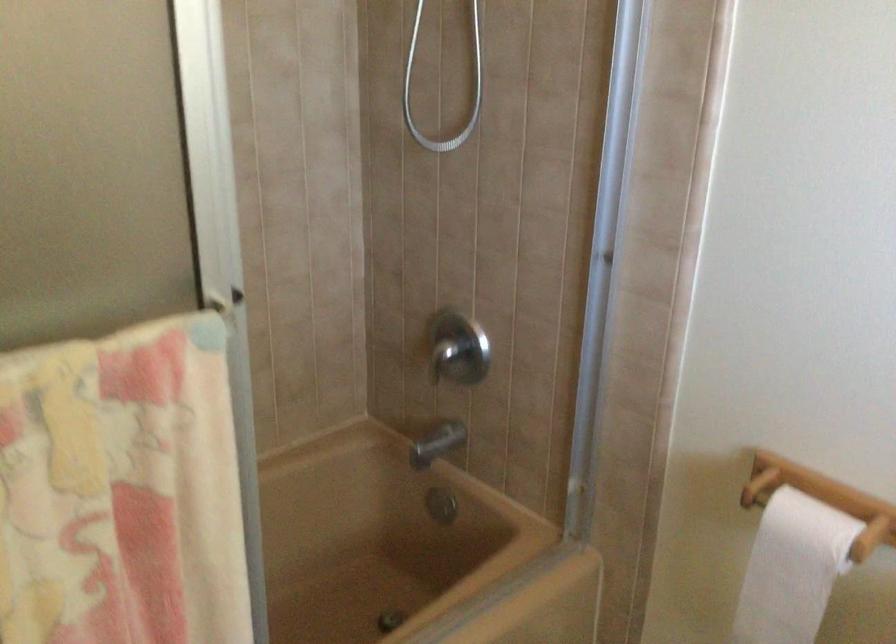
What are the coordinates of `chrome faucet handle` in the screenshot? It's located at (436, 444).